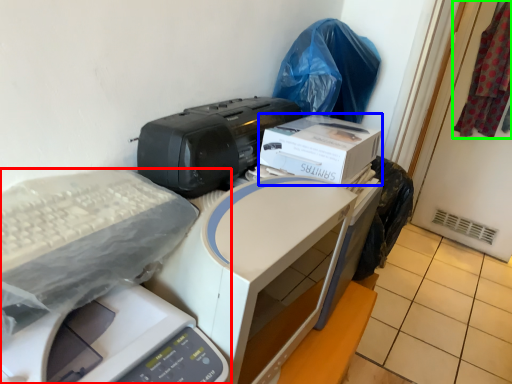
Question: Estimate the real-world distances between objects in this image. Which object is farther from printer (highlighted by a red box), box (highlighted by a blue box) or material (highlighted by a green box)?

Choices:
 (A) box
 (B) material

Answer: (B)